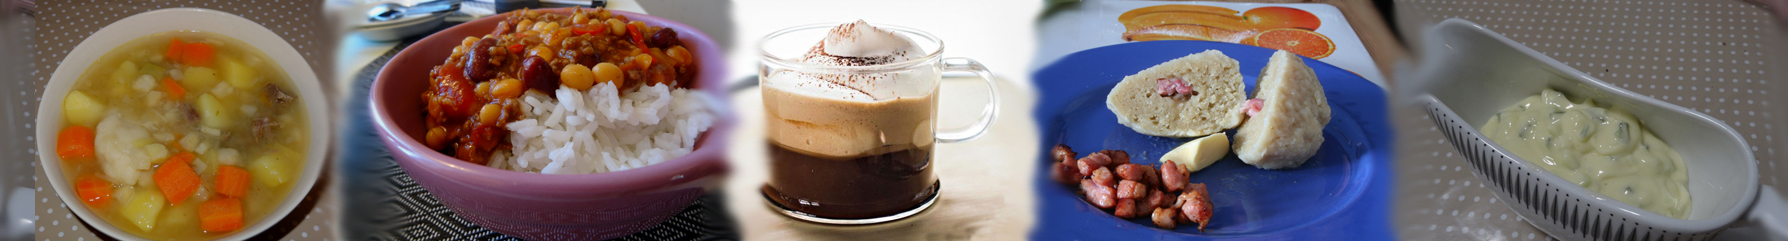
Where is `cup handle to hold the cup`? This screenshot has height=241, width=1788. cup handle to hold the cup is located at coordinates (983, 117).